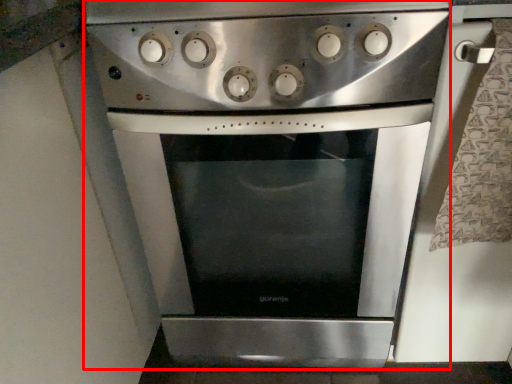
Question: Observing the image, what is the correct spatial positioning of oven (annotated by the red box) in reference to gas stove?

Choices:
 (A) right
 (B) left

Answer: (A)